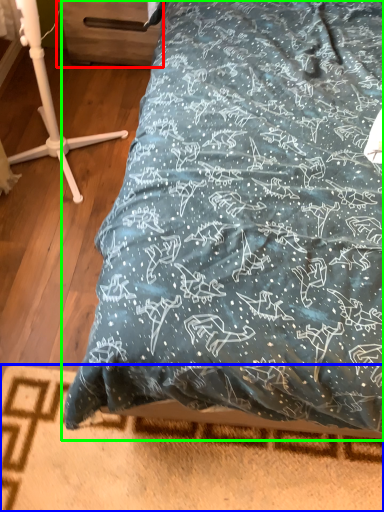
Question: Which object is positioned farthest from drawer (highlighted by a red box)? Select from bed frame (highlighted by a blue box) and bed (highlighted by a green box).

Choices:
 (A) bed frame
 (B) bed

Answer: (A)